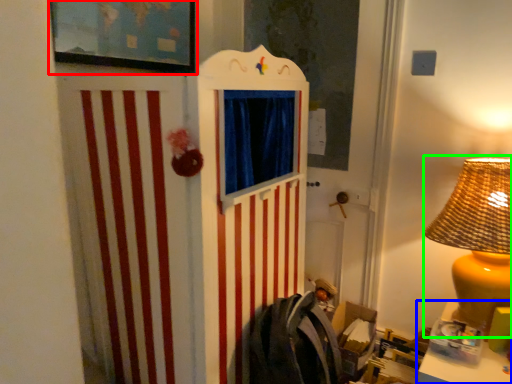
Question: Which object is positioned closest to picture frame (highlighted by a red box)? Select from table (highlighted by a blue box) and table lamp (highlighted by a green box).

Choices:
 (A) table
 (B) table lamp

Answer: (B)